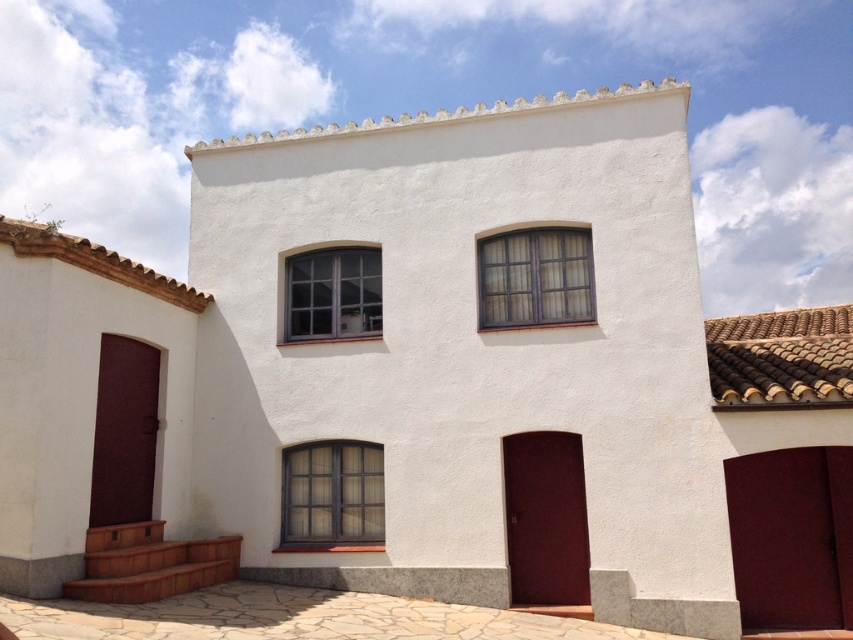
Question: Can you confirm if brown clay tiles at upper right is positioned above matte gray window at center?

Choices:
 (A) yes
 (B) no

Answer: (B)

Question: Is matte glass window at upper center above matte gray window at center?

Choices:
 (A) no
 (B) yes

Answer: (B)

Question: Which of the following is the farthest from the observer?

Choices:
 (A) (537, 320)
 (B) (370, 525)

Answer: (A)

Question: Which object is the farthest from the matte glass window at center?

Choices:
 (A) matte gray window at center
 (B) brown clay tiles at upper right

Answer: (B)

Question: Is brown clay tiles at upper right in front of matte glass window at upper center?

Choices:
 (A) yes
 (B) no

Answer: (A)

Question: Which object appears closest to the camera in this image?

Choices:
 (A) matte glass window at center
 (B) matte gray window at center

Answer: (A)